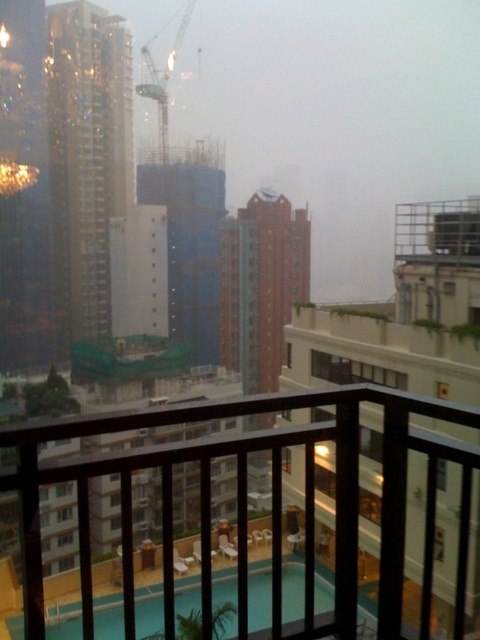
Can you confirm if white concrete building at center is positioned to the right of metal mesh balcony at upper right?

In fact, white concrete building at center is to the left of metal mesh balcony at upper right.

Between white concrete building at center and metal mesh balcony at upper right, which one is positioned lower?

white concrete building at center

Does point (420, 346) come in front of point (420, 257)?

Yes, point (420, 346) is closer to viewer.

This screenshot has height=640, width=480. I want to click on white concrete building at center, so click(x=404, y=316).

Is point (348, 620) in front of point (446, 225)?

Yes, it is in front of point (446, 225).

Can you confirm if black wooden railing at center is positioned above metal mesh balcony at upper right?

No.

Describe the element at coordinates (245, 502) in the screenshot. The height and width of the screenshot is (640, 480). I see `black wooden railing at center` at that location.

Find the location of `black wooden railing at center`. black wooden railing at center is located at coordinates (245, 502).

Is white concrete building at center thinner than metallic blue crane at upper center?

Yes.

Find the location of `white concrete building at center`. white concrete building at center is located at coordinates (404, 316).

In order to click on white concrete building at center in this screenshot , I will do `click(404, 316)`.